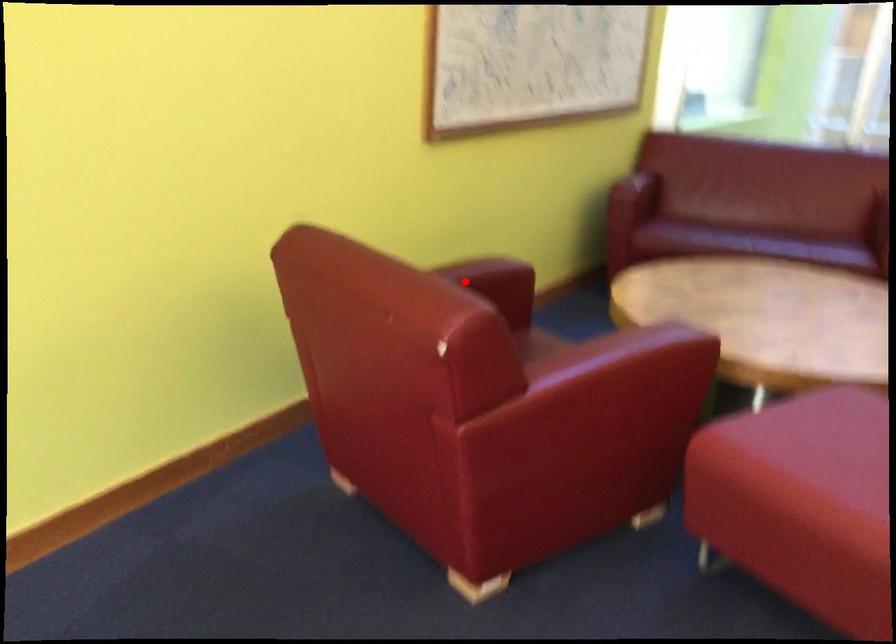
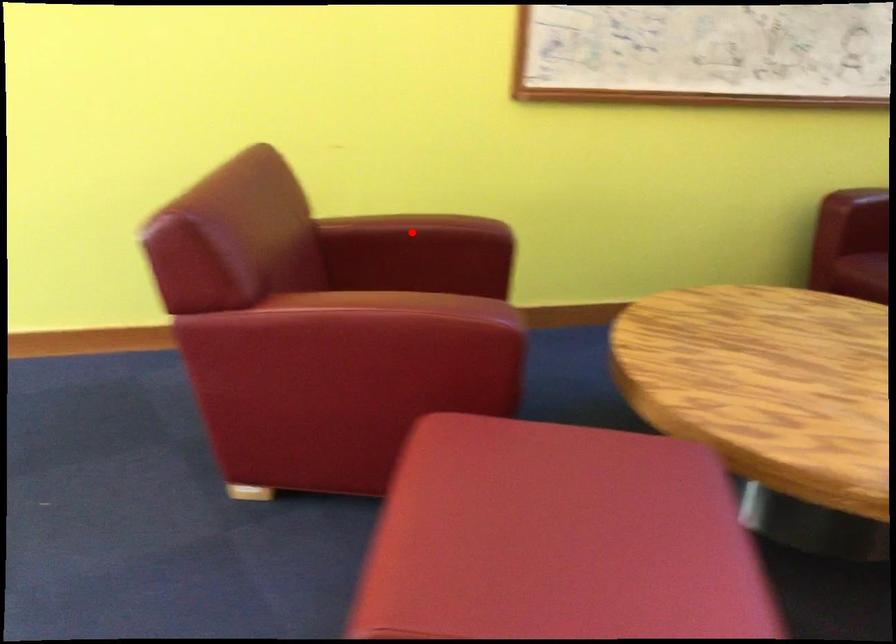
I am providing you with two images of the same scene from different viewpoints. A red point is marked on the first image and another point is marked on the second image. Is the red point in image1 aligned with the point shown in image2?

Yes